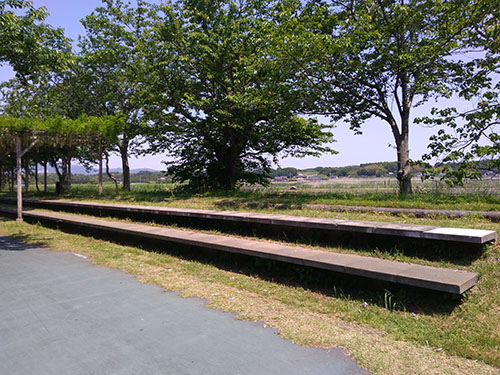
Where is `bench`? bench is located at coordinates tap(260, 248), tap(293, 220).